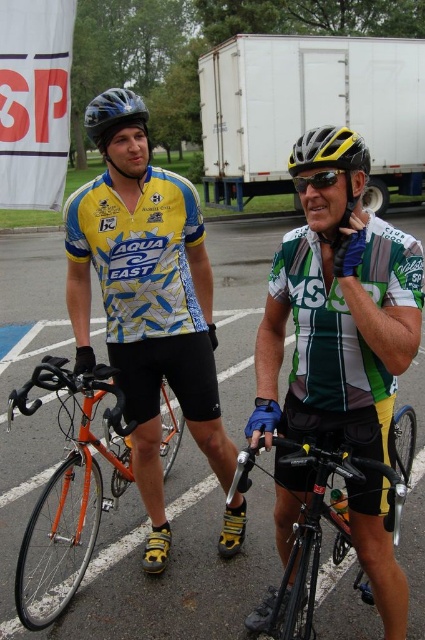
Question: Is white matte trailer truck at upper center wider than yellow and black helmet at center?

Choices:
 (A) yes
 (B) no

Answer: (A)

Question: Which of the following is the farthest from the observer?

Choices:
 (A) (306, 122)
 (B) (118, 380)
 (C) (306, 145)
 (D) (136, 97)

Answer: (A)

Question: Is yellow and black helmet at center thinner than matte black helmet at upper left?

Choices:
 (A) yes
 (B) no

Answer: (A)

Question: Which point appears farthest from the camera in this image?

Choices:
 (A) coord(22,561)
 (B) coord(374,145)
 (C) coord(113,186)

Answer: (B)

Question: Which point appears closest to the camera in this image?

Choices:
 (A) (339, 122)
 (B) (96, 109)

Answer: (B)

Question: Is green and white jersey at center thinner than yellow matte helmet at center?

Choices:
 (A) no
 (B) yes

Answer: (A)